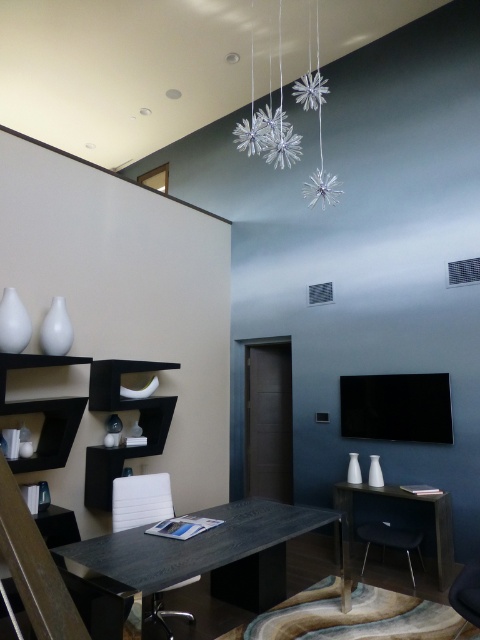
Between black wood table at center and white leather armchair at center, which one is positioned higher?

white leather armchair at center is above.

Between black wood table at center and white leather armchair at center, which one has more height?

white leather armchair at center is taller.

Locate an element on the screen. The height and width of the screenshot is (640, 480). black wood table at center is located at coordinates (187, 561).

Between point (272, 163) and point (443, 529), which one is positioned behind?

The point (272, 163) is behind.

Identify the location of silver metallic snowflake at upper center. The height and width of the screenshot is (640, 480). (269, 129).

Is black wood table at center above dark wood table at center?

Correct, black wood table at center is located above dark wood table at center.

Can you confirm if black wood table at center is positioned to the right of dark wood table at center?

In fact, black wood table at center is to the left of dark wood table at center.

What do you see at coordinates (187, 561) in the screenshot? This screenshot has width=480, height=640. I see `black wood table at center` at bounding box center [187, 561].

Where is `black wood table at center`? Image resolution: width=480 pixels, height=640 pixels. black wood table at center is located at coordinates (187, 561).